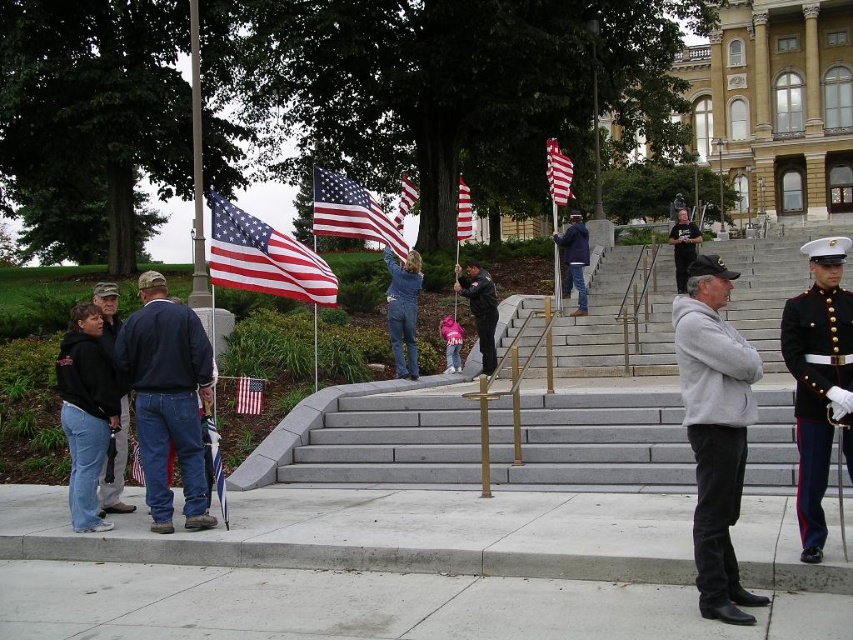
Which is more to the right, black fleece hoodie at lower left or metallic flag pole at center?

Positioned to the right is black fleece hoodie at lower left.

Which is in front, point (82, 346) or point (196, 0)?

Positioned in front is point (82, 346).

Between point (68, 339) and point (193, 86), which one is positioned behind?

Point (193, 86)

Locate an element on the screen. black fleece hoodie at lower left is located at coordinates (86, 417).

Is point (824, 344) farther from camera compared to point (215, 237)?

No, (824, 344) is in front of (215, 237).

Which is below, shiny dark blue uniform at right or matte fabric flag at center?

shiny dark blue uniform at right is below.

Locate an element on the screen. shiny dark blue uniform at right is located at coordinates (815, 392).

Is denim jacket at center to the right of red-white striped flag at center from the viewer's perspective?

Indeed, denim jacket at center is positioned on the right side of red-white striped flag at center.

Locate an element on the screen. The image size is (853, 640). denim jacket at center is located at coordinates (403, 310).

At what (x,y) coordinates should I click in order to perform the action: click on denim jacket at center. Please return your answer as a coordinate pair (x, y). Looking at the image, I should click on (403, 310).